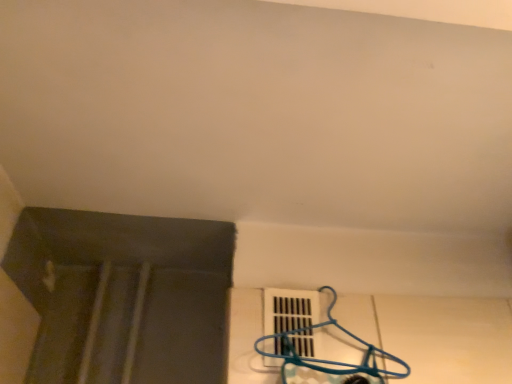
What do you see at coordinates (327, 360) in the screenshot? I see `blue plastic hanger at lower right` at bounding box center [327, 360].

Locate an element on the screen. blue plastic hanger at lower right is located at coordinates (327, 360).

At what (x,y) coordinates should I click in order to perform the action: click on white plastic vent at lower center. Please return your answer as a coordinate pair (x, y). Image resolution: width=512 pixels, height=384 pixels. Looking at the image, I should click on (289, 309).

What do you see at coordinates (289, 309) in the screenshot? The width and height of the screenshot is (512, 384). I see `white plastic vent at lower center` at bounding box center [289, 309].

Looking at this image, what is the approximate height of white plastic vent at lower center?

white plastic vent at lower center is 6.78 inches in height.

This screenshot has width=512, height=384. Find the location of `blue plastic hanger at lower right`. blue plastic hanger at lower right is located at coordinates (327, 360).

From the picture: Can you confirm if white plastic vent at lower center is positioned to the right of blue plastic hanger at lower right?

No, white plastic vent at lower center is not to the right of blue plastic hanger at lower right.

From the picture: Which is in front, white plastic vent at lower center or blue plastic hanger at lower right?

blue plastic hanger at lower right.

Is point (264, 301) farther from viewer compared to point (292, 350)?

Yes, it is behind point (292, 350).

From the image's perspective, is white plastic vent at lower center located beneath blue plastic hanger at lower right?

Yes, from the image's perspective, white plastic vent at lower center is beneath blue plastic hanger at lower right.

From a real-world perspective, who is located lower, white plastic vent at lower center or blue plastic hanger at lower right?

white plastic vent at lower center is physically lower.

Can you confirm if white plastic vent at lower center is thinner than blue plastic hanger at lower right?

Indeed, white plastic vent at lower center has a lesser width compared to blue plastic hanger at lower right.

In terms of height, does white plastic vent at lower center look taller or shorter compared to blue plastic hanger at lower right?

Considering their sizes, white plastic vent at lower center has less height than blue plastic hanger at lower right.

Based on their sizes in the image, would you say white plastic vent at lower center is bigger or smaller than blue plastic hanger at lower right?

In the image, white plastic vent at lower center appears to be smaller than blue plastic hanger at lower right.

Could blue plastic hanger at lower right be considered to be inside white plastic vent at lower center?

No, blue plastic hanger at lower right is not a part of white plastic vent at lower center.

Is white plastic vent at lower center directly adjacent to blue plastic hanger at lower right?

Yes, white plastic vent at lower center is right next to blue plastic hanger at lower right and making contact.

Could you tell me if white plastic vent at lower center is turned towards blue plastic hanger at lower right?

Yes.

Locate an element on the screen. hanger that appears above the white plastic vent at lower center (from the image's perspective) is located at coordinates (327, 360).

Can you confirm if blue plastic hanger at lower right is positioned to the right of white plastic vent at lower center?

Correct, you'll find blue plastic hanger at lower right to the right of white plastic vent at lower center.

Which is behind, blue plastic hanger at lower right or white plastic vent at lower center?

A: white plastic vent at lower center is further from the camera.

Which is behind, point (290, 347) or point (279, 326)?

Positioned behind is point (279, 326).

From the image's perspective, which is above, blue plastic hanger at lower right or white plastic vent at lower center?

blue plastic hanger at lower right.

From a real-world perspective, which is physically below, blue plastic hanger at lower right or white plastic vent at lower center?

white plastic vent at lower center, from a real-world perspective.

Looking at their sizes, would you say blue plastic hanger at lower right is wider or thinner than white plastic vent at lower center?

blue plastic hanger at lower right is wider than white plastic vent at lower center.

Does blue plastic hanger at lower right have a greater height compared to white plastic vent at lower center?

Correct, blue plastic hanger at lower right is much taller as white plastic vent at lower center.

In the scene shown: Does blue plastic hanger at lower right have a smaller size compared to white plastic vent at lower center?

Actually, blue plastic hanger at lower right might be larger than white plastic vent at lower center.

Is blue plastic hanger at lower right inside the boundaries of white plastic vent at lower center, or outside?

blue plastic hanger at lower right exists outside the volume of white plastic vent at lower center.

Is blue plastic hanger at lower right beside white plastic vent at lower center?

Yes, blue plastic hanger at lower right is in contact with white plastic vent at lower center.

Is blue plastic hanger at lower right facing away from white plastic vent at lower center?

Absolutely, blue plastic hanger at lower right is directed away from white plastic vent at lower center.

Measure the distance from blue plastic hanger at lower right to white plastic vent at lower center.

A distance of 1.76 inches exists between blue plastic hanger at lower right and white plastic vent at lower center.

You are a GUI agent. You are given a task and a screenshot of the screen. Output one action in this format:
    pyautogui.click(x=<x>, y=<y>)
    Task: Click on the window on the left side of blue plastic hanger at lower right
    The height and width of the screenshot is (384, 512).
    Given the screenshot: What is the action you would take?
    pyautogui.click(x=289, y=309)

Locate an element on the screen. The width and height of the screenshot is (512, 384). hanger located above the white plastic vent at lower center (from the image's perspective) is located at coordinates (327, 360).

The height and width of the screenshot is (384, 512). In order to click on hanger on the right of white plastic vent at lower center in this screenshot , I will do `click(327, 360)`.